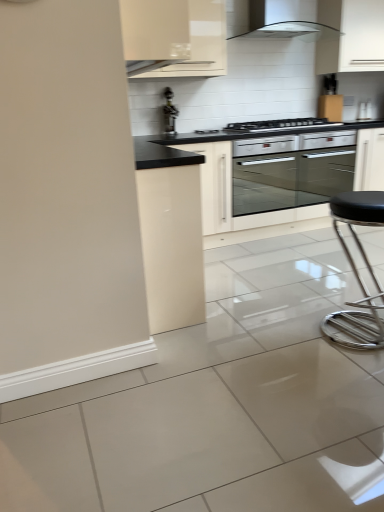
Question: Is metallic gold faucet at upper center far away from metallic silver bar stool at right?

Choices:
 (A) yes
 (B) no

Answer: (A)

Question: Does metallic gold faucet at upper center have a greater height compared to metallic silver bar stool at right?

Choices:
 (A) yes
 (B) no

Answer: (B)

Question: Can you confirm if metallic gold faucet at upper center is positioned to the left of metallic silver bar stool at right?

Choices:
 (A) no
 (B) yes

Answer: (B)

Question: Is metallic gold faucet at upper center at the right side of metallic silver bar stool at right?

Choices:
 (A) no
 (B) yes

Answer: (A)

Question: From a real-world perspective, does metallic gold faucet at upper center sit lower than metallic silver bar stool at right?

Choices:
 (A) no
 (B) yes

Answer: (A)

Question: Is white glossy cabinet at upper right, arranged as the second cabinetry when viewed from the left, to the left or to the right of black glass cooktop at center in the image?

Choices:
 (A) right
 (B) left

Answer: (A)

Question: Considering the positions of white glossy cabinet at upper right, which is the first cabinetry from back to front, and black glass cooktop at center in the image, is white glossy cabinet at upper right, which is the first cabinetry from back to front, wider or thinner than black glass cooktop at center?

Choices:
 (A) wide
 (B) thin

Answer: (B)

Question: From their relative heights in the image, would you say white glossy cabinet at upper right, which is the first cabinetry from back to front, is taller or shorter than black glass cooktop at center?

Choices:
 (A) tall
 (B) short

Answer: (A)

Question: From the image's perspective, is white glossy cabinet at upper right, placed as the first cabinetry when sorted from right to left, located above or below black glass cooktop at center?

Choices:
 (A) below
 (B) above

Answer: (B)

Question: Is black glass cooktop at center spatially inside metallic gold faucet at upper center, or outside of it?

Choices:
 (A) outside
 (B) inside

Answer: (A)

Question: Is black glass cooktop at center wider or thinner than metallic gold faucet at upper center?

Choices:
 (A) wide
 (B) thin

Answer: (A)

Question: Would you say black glass cooktop at center is to the left or to the right of metallic gold faucet at upper center in the picture?

Choices:
 (A) left
 (B) right

Answer: (B)

Question: Considering the positions of point (223, 129) and point (170, 131), is point (223, 129) closer or farther from the camera than point (170, 131)?

Choices:
 (A) farther
 (B) closer

Answer: (B)

Question: Relative to metallic silver bar stool at right, is metallic gold faucet at upper center in front or behind?

Choices:
 (A) behind
 (B) front

Answer: (A)

Question: From the image's perspective, is metallic gold faucet at upper center positioned above or below metallic silver bar stool at right?

Choices:
 (A) above
 (B) below

Answer: (A)